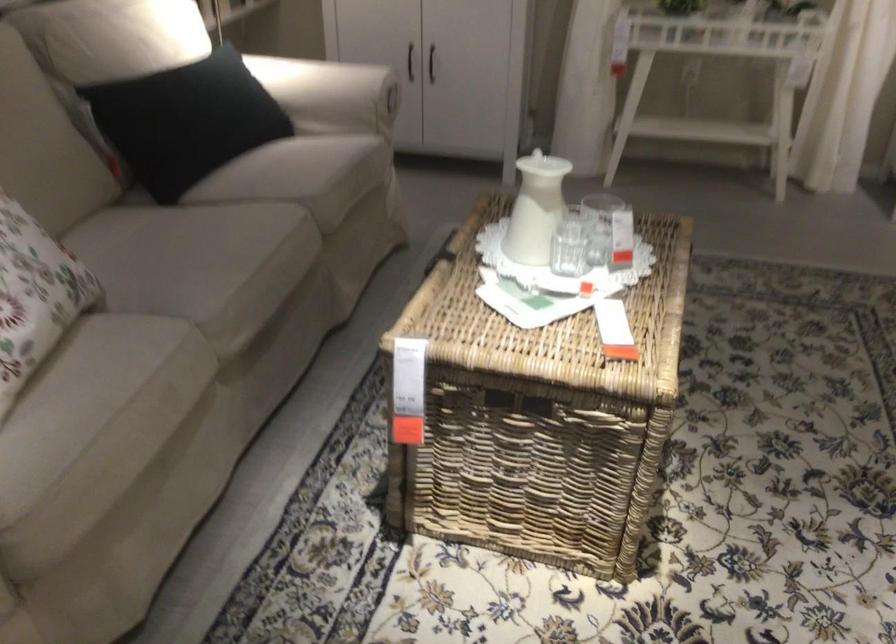
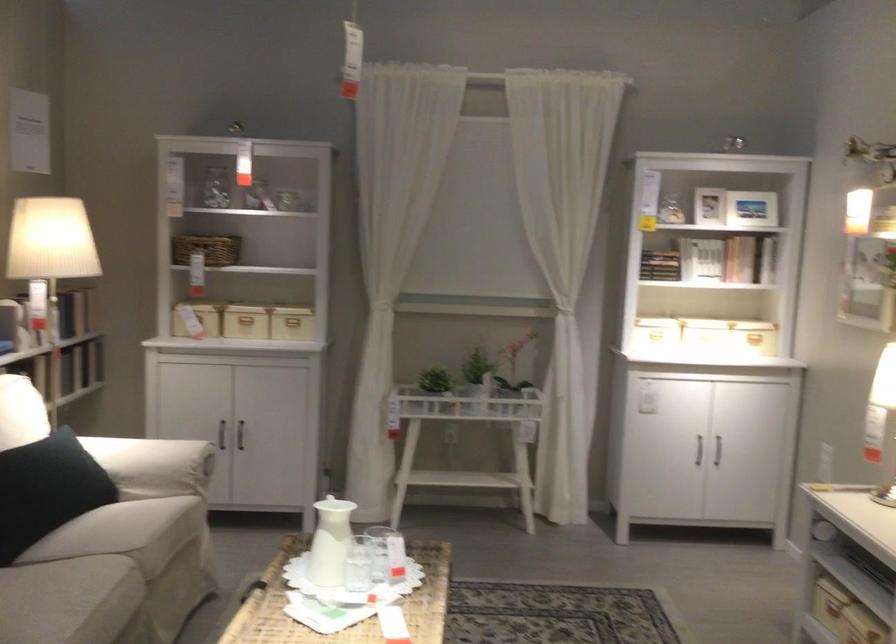
Find the pixel in the second image that matches point (323, 91) in the first image.

(152, 465)